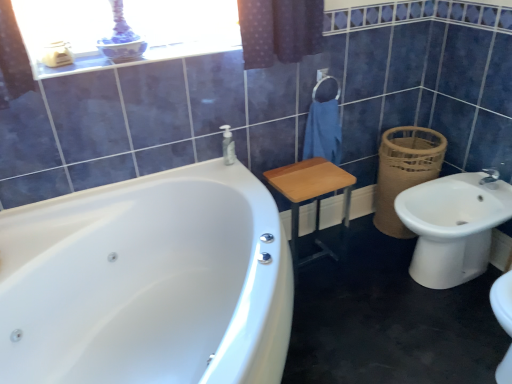
Find the location of a particular element. This screenshot has width=512, height=384. vacant space in front of white glossy sink at lower right is located at coordinates (444, 330).